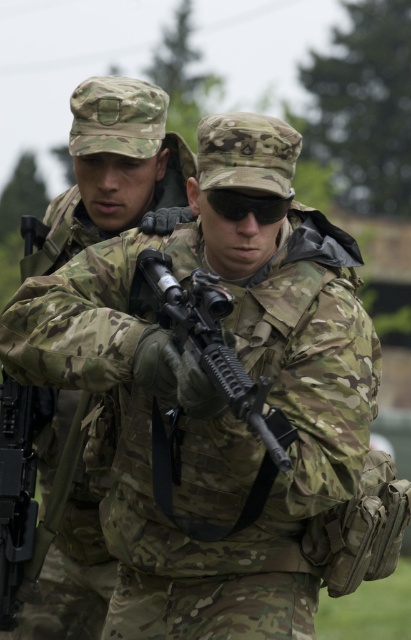
You are a military supply officer tasked with packing gear into a transport container. The container has a width limit of 1 meter. You have to place both the camo uniform at center and the matte black rifle at center inside. Which item will require more space in width to fit properly?

The camo uniform at center has a larger width than the matte black rifle at center, so the camo uniform at center will require more space in width to fit properly.

You are a drone operator controlling a drone that needs to fly from point A to point B. The path must stay above the two individuals in the image. The first point is at coordinates point A at (124, 81) and the second point is at point B at (193, 308). Since the path must stay above both individuals, which point should the drone start from to ensure it can safely navigate between them?

Point A at (124, 81) is behind point B at (193, 308). To ensure the drone can safely navigate between them while staying above both individuals, the drone should start from point B at (193, 308) and fly towards point A at (124, 81). This way, the path will naturally stay above both individuals as it moves from the front to the back.

Based on the scene description, can you determine if the camo uniform at center is positioned higher than the matte black rifle at center?

Yes, the camo uniform at center is located above the matte black rifle at center, so it is positioned higher.